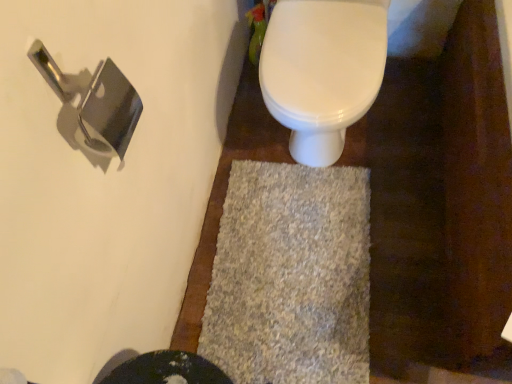
What is the approximate height of polished silver door handle at upper left?

9.91 inches.

Describe the element at coordinates (291, 276) in the screenshot. This screenshot has height=384, width=512. I see `gray shaggy bath mat at center` at that location.

This screenshot has width=512, height=384. Find the location of `polished silver door handle at upper left`. polished silver door handle at upper left is located at coordinates (95, 102).

Is gray shaggy bath mat at center facing towards white glossy toilet at upper center?

No, gray shaggy bath mat at center does not turn towards white glossy toilet at upper center.

Between point (361, 306) and point (358, 3), which one is positioned in front?

The point (358, 3) is in front.

Can you confirm if gray shaggy bath mat at center is bigger than white glossy toilet at upper center?

Incorrect, gray shaggy bath mat at center is not larger than white glossy toilet at upper center.

Between gray shaggy bath mat at center and white glossy toilet at upper center, which one appears on the right side from the viewer's perspective?

Positioned to the right is white glossy toilet at upper center.

Is white glossy toilet at upper center facing away from polished silver door handle at upper left?

That's not correct — white glossy toilet at upper center is not looking away from polished silver door handle at upper left.

Measure the distance between white glossy toilet at upper center and polished silver door handle at upper left.

The distance of white glossy toilet at upper center from polished silver door handle at upper left is 23.60 inches.

Which of these two, white glossy toilet at upper center or polished silver door handle at upper left, is wider?

Wider between the two is white glossy toilet at upper center.

From a real-world perspective, is white glossy toilet at upper center above or below polished silver door handle at upper left?

Clearly, from a real-world perspective, white glossy toilet at upper center is below polished silver door handle at upper left.

Which is more to the left, polished silver door handle at upper left or white glossy toilet at upper center?

polished silver door handle at upper left.

Find the location of a particular element. Image resolution: width=512 pixels, height=384 pixels. toilet above the polished silver door handle at upper left (from the image's perspective) is located at coordinates (322, 71).

How different are the orientations of polished silver door handle at upper left and white glossy toilet at upper center in degrees?

polished silver door handle at upper left and white glossy toilet at upper center are facing 88.7 degrees away from each other.

From the image's perspective, which object appears higher, polished silver door handle at upper left or white glossy toilet at upper center?

white glossy toilet at upper center.

Can you confirm if white glossy toilet at upper center is bigger than gray shaggy bath mat at center?

Answer: Correct, white glossy toilet at upper center is larger in size than gray shaggy bath mat at center.

In terms of width, does white glossy toilet at upper center look wider or thinner when compared to gray shaggy bath mat at center?

white glossy toilet at upper center is thinner than gray shaggy bath mat at center.

The width and height of the screenshot is (512, 384). Identify the location of toilet above the gray shaggy bath mat at center (from the image's perspective). (322, 71).

From the image's perspective, which is above, white glossy toilet at upper center or gray shaggy bath mat at center?

white glossy toilet at upper center is shown above in the image.

Considering the relative sizes of gray shaggy bath mat at center and polished silver door handle at upper left in the image provided, is gray shaggy bath mat at center taller than polished silver door handle at upper left?

In fact, gray shaggy bath mat at center may be shorter than polished silver door handle at upper left.

Is gray shaggy bath mat at center closer to the viewer compared to polished silver door handle at upper left?

No, the depth of gray shaggy bath mat at center is greater than that of polished silver door handle at upper left.

Does polished silver door handle at upper left come in front of gray shaggy bath mat at center?

Yes.

Considering the points (129, 130) and (219, 250), which point is behind, point (129, 130) or point (219, 250)?

The point (219, 250) is behind.

From the image's perspective, between polished silver door handle at upper left and gray shaggy bath mat at center, which one is located above?

polished silver door handle at upper left appears higher in the image.

Locate an element on the screen. toilet above the gray shaggy bath mat at center (from the image's perspective) is located at coordinates [x=322, y=71].

Where is `toilet on the right of polished silver door handle at upper left`? toilet on the right of polished silver door handle at upper left is located at coordinates 322,71.

Estimate the real-world distances between objects in this image. Which object is closer to gray shaggy bath mat at center, white glossy toilet at upper center or polished silver door handle at upper left?

Based on the image, white glossy toilet at upper center appears to be nearer to gray shaggy bath mat at center.

Based on the photo, which object lies nearer to the anchor point polished silver door handle at upper left, gray shaggy bath mat at center or white glossy toilet at upper center?

white glossy toilet at upper center.

Considering their positions, is polished silver door handle at upper left positioned closer to gray shaggy bath mat at center than white glossy toilet at upper center?

Based on the image, white glossy toilet at upper center appears to be nearer to gray shaggy bath mat at center.

When comparing their distances from polished silver door handle at upper left, does white glossy toilet at upper center or gray shaggy bath mat at center seem closer?

white glossy toilet at upper center is positioned closer to the anchor polished silver door handle at upper left.

Based on their spatial positions, is polished silver door handle at upper left or gray shaggy bath mat at center further from white glossy toilet at upper center?

Among the two, polished silver door handle at upper left is located further to white glossy toilet at upper center.

Based on their spatial positions, is gray shaggy bath mat at center or polished silver door handle at upper left closer to white glossy toilet at upper center?

Among the two, gray shaggy bath mat at center is located nearer to white glossy toilet at upper center.

The height and width of the screenshot is (384, 512). I want to click on door handle that lies between white glossy toilet at upper center and gray shaggy bath mat at center from top to bottom, so tap(95, 102).